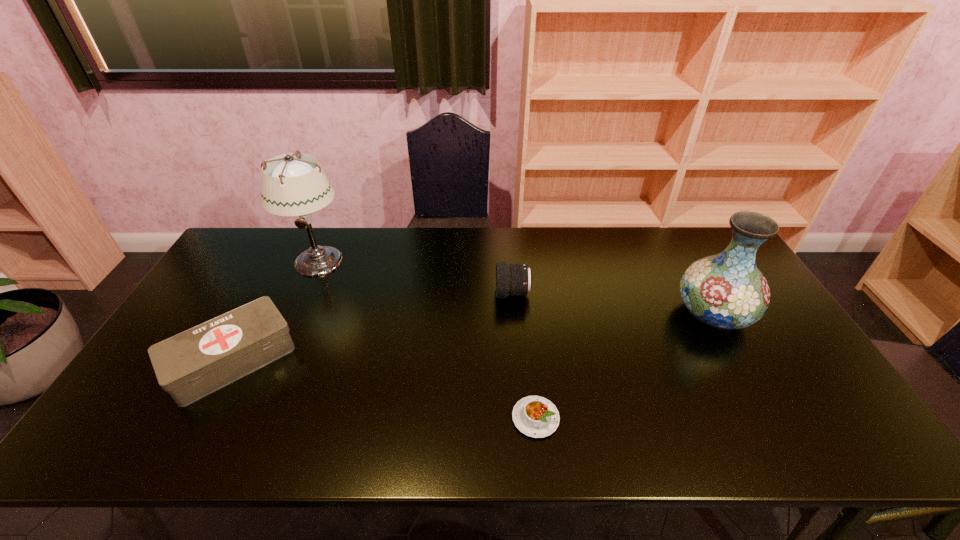
Image resolution: width=960 pixels, height=540 pixels. Identify the location of lampshade. (291, 186).

Locate an element on the screen. Image resolution: width=960 pixels, height=540 pixels. the second tallest object is located at coordinates (724, 291).

In order to click on vase in this screenshot , I will do `click(724, 291)`.

Image resolution: width=960 pixels, height=540 pixels. I want to click on telephoto lens, so click(512, 279).

You are a GUI agent. You are given a task and a screenshot of the screen. Output one action in this format:
    pyautogui.click(x=<x>, y=<y>)
    Task: Click on the second shortest object
    Image resolution: width=960 pixels, height=540 pixels.
    Given the screenshot: What is the action you would take?
    pyautogui.click(x=192, y=364)

Locate an element on the screen. pudding is located at coordinates (535, 416).

You are a GUI agent. You are given a task and a screenshot of the screen. Output one action in this format:
    pyautogui.click(x=<x>, y=<y>)
    Task: Click on the vacant region located 0.270m on the lampshade of the tallest object
    This screenshot has height=540, width=960.
    Given the screenshot: What is the action you would take?
    pyautogui.click(x=279, y=348)

Locate an element on the screen. Image resolution: width=960 pixels, height=540 pixels. vacant space situated on the back of the vase is located at coordinates (688, 269).

At what (x,y) coordinates should I click in order to perform the action: click on free region located 0.260m at the front element of the telephoto lens. Please return your answer as a coordinate pair (x, y). The image size is (960, 540). Looking at the image, I should click on (412, 293).

Where is `vacant region located at the front element of the telephoto lens`? This screenshot has height=540, width=960. vacant region located at the front element of the telephoto lens is located at coordinates (367, 293).